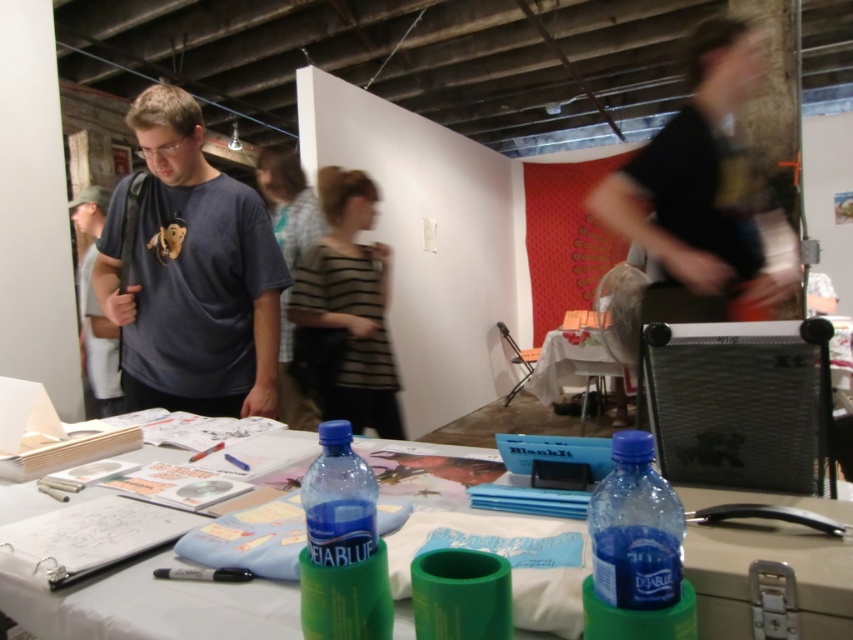
You are organizing a workshop and need to place the striped fabric shirt at center and the white paper at center on a small shelf. Which item should you place first to ensure both fit on the shelf?

The striped fabric shirt at center is larger in size than the white paper at center, so you should place the striped fabric shirt at center first to ensure both items fit on the shelf.

You are organizing a workshop and need to place a new item on the table. The table has limited space. You have to decide between placing the item on the black matte shirt at upper right or the white paper at center. Based on their positions, which surface is lower and thus more suitable for placing heavier items?

The white paper at center is lower than the black matte shirt at upper right. Therefore, the white paper at center is more suitable for placing heavier items.

You need to place a rectangular box that is 1.2 meters long on the translucent plastic table at center. Considering the table and bottle dimensions, will the box fit on the table without touching the blue translucent bottle at center?

The translucent plastic table at center is wider than the blue translucent bottle at center, but the question mentions the box is 1.2 meters long. Since the table width isn not specified numerically, we cannot definitively determine if the box will fit without more information about the table and bottle dimensions beyond their relative sizes.